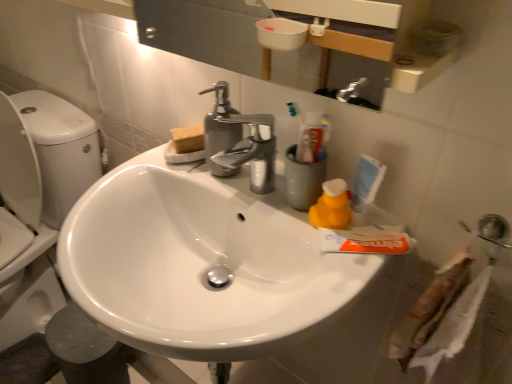
Measure the distance between yellow rubber duck at right and camera.

They are 27.93 inches apart.

I want to click on chrome metallic faucet at center, so click(251, 151).

This screenshot has height=384, width=512. What do you see at coordinates (201, 264) in the screenshot?
I see `white glossy sink at center` at bounding box center [201, 264].

Describe the element at coordinates (220, 130) in the screenshot. I see `satin nickel faucet at upper center, positioned as the 1th plumbing fixture in left-to-right order` at that location.

Identify the location of satin nickel faucet at upper center, which appears as the 2th plumbing fixture when viewed from the right. (220, 130).

I want to click on metallic silver sink at lower right, marked as the first plumbing fixture in a bottom-to-top arrangement, so click(493, 230).

Is satin nickel faucet at upper center, marked as the first plumbing fixture in a top-to-bottom arrangement, not close to white glossy sink at center?

No, there isn't a large distance between satin nickel faucet at upper center, marked as the first plumbing fixture in a top-to-bottom arrangement, and white glossy sink at center.

Which of these two, satin nickel faucet at upper center, positioned as the 1th plumbing fixture in left-to-right order, or white glossy sink at center, is wider?

white glossy sink at center.

Choose the correct answer: Is satin nickel faucet at upper center, placed as the 2th plumbing fixture when sorted from front to back, inside white glossy sink at center or outside it?

satin nickel faucet at upper center, placed as the 2th plumbing fixture when sorted from front to back, is not inside white glossy sink at center, it's outside.

Considering the sizes of satin nickel faucet at upper center, which appears as the 2th plumbing fixture when viewed from the right, and white glossy sink at center in the image, is satin nickel faucet at upper center, which appears as the 2th plumbing fixture when viewed from the right, taller or shorter than white glossy sink at center?

Considering their sizes, satin nickel faucet at upper center, which appears as the 2th plumbing fixture when viewed from the right, has more height than white glossy sink at center.

Is chrome metallic faucet at center at the right side of yellow rubber duck at right?

Incorrect, chrome metallic faucet at center is not on the right side of yellow rubber duck at right.

Image resolution: width=512 pixels, height=384 pixels. Identify the location of cleaning product below the chrome metallic faucet at center (from the image's perspective). (332, 206).

Is chrome metallic faucet at center directly adjacent to yellow rubber duck at right?

No, chrome metallic faucet at center is not in contact with yellow rubber duck at right.

Considering the sizes of objects chrome metallic faucet at center and yellow rubber duck at right in the image provided, who is smaller, chrome metallic faucet at center or yellow rubber duck at right?

yellow rubber duck at right is smaller.

Is yellow rubber duck at right wider than chrome metallic faucet at center?

Incorrect, the width of yellow rubber duck at right does not surpass that of chrome metallic faucet at center.

Is yellow rubber duck at right outside of chrome metallic faucet at center?

Indeed, yellow rubber duck at right is completely outside chrome metallic faucet at center.

Does yellow rubber duck at right have a larger size compared to chrome metallic faucet at center?

Incorrect, yellow rubber duck at right is not larger than chrome metallic faucet at center.

Does yellow rubber duck at right come behind chrome metallic faucet at center?

That is True.

How much distance is there between yellow rubber duck at right and white glossy sink at center?

A distance of 9.76 inches exists between yellow rubber duck at right and white glossy sink at center.

From the picture: Is yellow rubber duck at right positioned in front of white glossy sink at center?

No, yellow rubber duck at right is behind white glossy sink at center.

Is yellow rubber duck at right not close to white glossy sink at center?

They are positioned close to each other.

Is yellow rubber duck at right wider or thinner than white glossy sink at center?

Clearly, yellow rubber duck at right has less width compared to white glossy sink at center.

Which of these two, white glossy sink at center or white matte toothpaste at center, is wider?

white glossy sink at center.

Where is `sink on the left of white matte toothpaste at center`? The width and height of the screenshot is (512, 384). sink on the left of white matte toothpaste at center is located at coordinates (201, 264).

From the image's perspective, relative to white matte toothpaste at center, is white glossy sink at center above or below?

white glossy sink at center is below white matte toothpaste at center.

Which object is further away from the camera taking this photo, chrome metallic faucet at center or satin nickel faucet at upper center, marked as the first plumbing fixture in a top-to-bottom arrangement?

satin nickel faucet at upper center, marked as the first plumbing fixture in a top-to-bottom arrangement, is more distant.

From the image's perspective, which object appears higher, chrome metallic faucet at center or satin nickel faucet at upper center, positioned as the 1th plumbing fixture in left-to-right order?

satin nickel faucet at upper center, positioned as the 1th plumbing fixture in left-to-right order, appears higher in the image.

Considering the sizes of objects satin nickel faucet at upper center, positioned as the 1th plumbing fixture in left-to-right order, and white matte toothpaste at center in the image provided, who is thinner, satin nickel faucet at upper center, positioned as the 1th plumbing fixture in left-to-right order, or white matte toothpaste at center?

With smaller width is satin nickel faucet at upper center, positioned as the 1th plumbing fixture in left-to-right order.

Who is smaller, satin nickel faucet at upper center, placed as the 2th plumbing fixture when sorted from front to back, or white matte toothpaste at center?

Smaller between the two is white matte toothpaste at center.

From the image's perspective, is satin nickel faucet at upper center, placed as the 2th plumbing fixture when sorted from front to back, over white matte toothpaste at center?

Indeed, from the image's perspective, satin nickel faucet at upper center, placed as the 2th plumbing fixture when sorted from front to back, is shown above white matte toothpaste at center.

From a real-world perspective, between satin nickel faucet at upper center, the first plumbing fixture when ordered from back to front, and white matte toothpaste at center, who is vertically higher?

From a 3D spatial view, satin nickel faucet at upper center, the first plumbing fixture when ordered from back to front, is above.

From a real-world perspective, which plumbing fixture is the 2nd one above the white glossy sink at center? Please provide its 2D coordinates.

[(220, 130)]

Where is `cleaning product that appears below the chrome metallic faucet at center (from the image's perspective)`? cleaning product that appears below the chrome metallic faucet at center (from the image's perspective) is located at coordinates (332, 206).

Based on their spatial positions, is satin nickel faucet at upper center, marked as the first plumbing fixture in a top-to-bottom arrangement, or metallic silver sink at lower right, the second plumbing fixture positioned from the top, closer to white matte toothpaste at center?

metallic silver sink at lower right, the second plumbing fixture positioned from the top, is closer to white matte toothpaste at center.

From the image, which object appears to be nearer to yellow rubber duck at right, satin nickel faucet at upper center, arranged as the second plumbing fixture when ordered from the bottom, or metallic silver sink at lower right, the 2th plumbing fixture viewed from the left?

Based on the image, metallic silver sink at lower right, the 2th plumbing fixture viewed from the left, appears to be nearer to yellow rubber duck at right.

Looking at the image, which one is located further to chrome metallic faucet at center, white glossy sink at center or satin nickel faucet at upper center, placed as the 2th plumbing fixture when sorted from front to back?

Based on the image, white glossy sink at center appears to be further to chrome metallic faucet at center.

From the image, which object appears to be nearer to yellow rubber duck at right, chrome metallic faucet at center or white glossy sink at center?

chrome metallic faucet at center is positioned closer to the anchor yellow rubber duck at right.

Based on their spatial positions, is white glossy sink at center or chrome metallic faucet at center further from metallic silver sink at lower right, the second plumbing fixture positioned from the top?

white glossy sink at center lies further to metallic silver sink at lower right, the second plumbing fixture positioned from the top, than the other object.

Estimate the real-world distances between objects in this image. Which object is further from chrome metallic faucet at center, white glossy sink at center or metallic silver sink at lower right, acting as the 1th plumbing fixture starting from the right?

metallic silver sink at lower right, acting as the 1th plumbing fixture starting from the right, is positioned further to the anchor chrome metallic faucet at center.

Based on the photo, considering their positions, is satin nickel faucet at upper center, marked as the first plumbing fixture in a top-to-bottom arrangement, positioned closer to metallic silver sink at lower right, acting as the 1th plumbing fixture starting from the right, than chrome metallic faucet at center?

chrome metallic faucet at center lies closer to metallic silver sink at lower right, acting as the 1th plumbing fixture starting from the right, than the other object.

Which object lies nearer to the anchor point yellow rubber duck at right, chrome metallic faucet at center or white matte toothpaste at center?

white matte toothpaste at center.

Where is `cleaning product between white glossy sink at center and satin nickel faucet at upper center, arranged as the second plumbing fixture when ordered from the bottom, from front to back`? cleaning product between white glossy sink at center and satin nickel faucet at upper center, arranged as the second plumbing fixture when ordered from the bottom, from front to back is located at coordinates (332, 206).

Identify the location of tap between satin nickel faucet at upper center, marked as the first plumbing fixture in a top-to-bottom arrangement, and white matte toothpaste at center from left to right. The image size is (512, 384). (251, 151).

Locate an element on the screen. This screenshot has height=384, width=512. cleaning product between satin nickel faucet at upper center, marked as the first plumbing fixture in a top-to-bottom arrangement, and white matte toothpaste at center from left to right is located at coordinates (332, 206).

In order to click on cleaning product between white glossy sink at center and metallic silver sink at lower right, acting as the 1th plumbing fixture starting from the right, in the horizontal direction in this screenshot , I will do `click(332, 206)`.